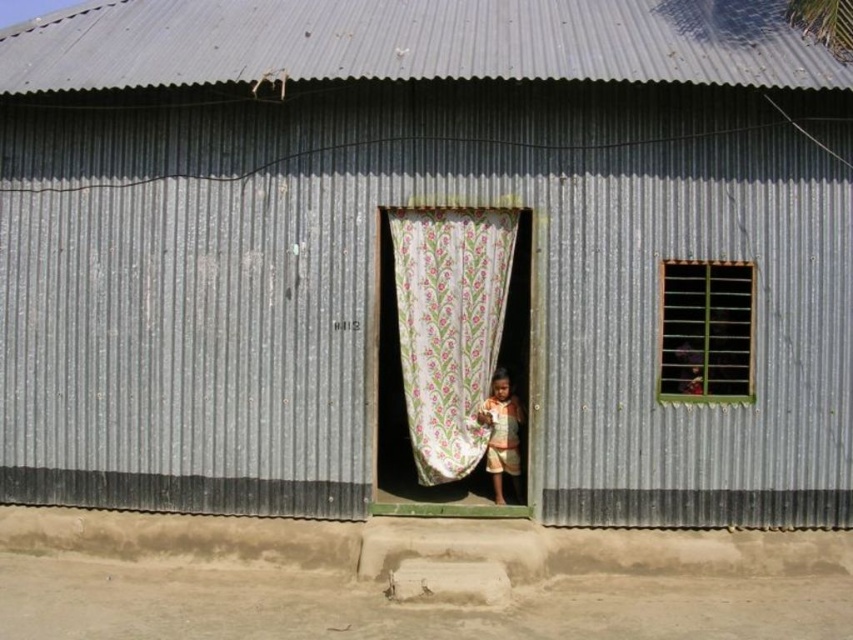
Based on the scene description, where exactly are the black metal bars at upper right located in terms of coordinates?

The black metal bars at upper right are located at point (x=706, y=330).

Based on the photo, you are standing outside the metal structure and want to enter through the doorway. Which object, the black metal bars at upper right or the light brown fabric at door center, is closer to you as you face the entrance?

The black metal bars at upper right are closer to the viewer than the light brown fabric at door center, so the black metal bars at upper right is closer to you as you face the entrance.